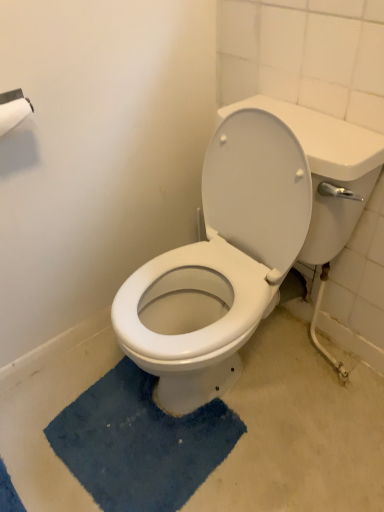
Locate an element on the screen. This screenshot has width=384, height=512. vacant area that is situated to the right of blue plush bath mat at lower center is located at coordinates (288, 464).